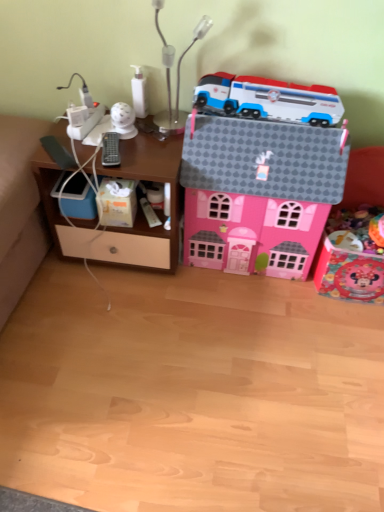
Question: Is point (119, 130) closer or farther from the camera than point (165, 64)?

Choices:
 (A) farther
 (B) closer

Answer: (A)

Question: In the image, is white glossy security camera at upper center, which is counted as the first toy, starting from the left, positioned in front of or behind metallic silver table lamp at upper center?

Choices:
 (A) behind
 (B) front

Answer: (A)

Question: Which of these objects is positioned closest to the white matte tissue box at lower left?

Choices:
 (A) white plastic container at lower center, the 3th toy when ordered from left to right
 (B) shiny pink toy house at right, which is the 1th toy from right to left
 (C) pink cardboard house at center, which appears as the 2th toy when viewed from the right
 (D) metallic silver table lamp at upper center
 (E) white plastic train at upper center, arranged as the fourth toy when viewed from the left

Answer: (A)

Question: Based on their relative distances, which object is nearer to the white glossy bottle at upper center, positioned as the 5th toy in right-to-left order?

Choices:
 (A) white plastic container at lower center, the fourth toy positioned from the right
 (B) metallic silver table lamp at upper center
 (C) shiny pink toy house at right, which appears as the 6th toy when viewed from the left
 (D) pink cardboard house at center, the 5th toy from the left
 (E) woodenmaterial/texturecomputer desk at left

Answer: (B)